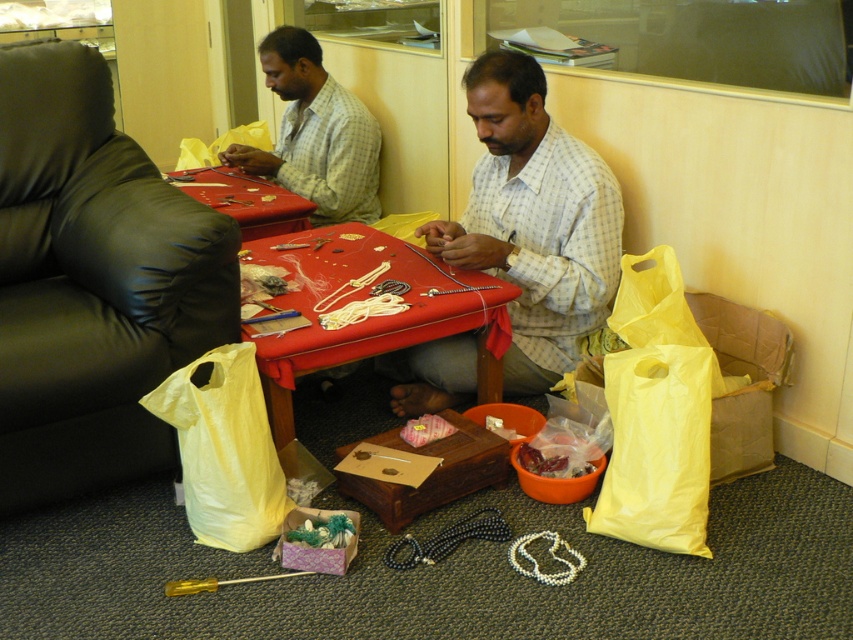
Question: Does white checkered shirt at center appear under translucent plastic bag at lower center?

Choices:
 (A) no
 (B) yes

Answer: (A)

Question: Is yellow plastic bag at lower right in front of red fabric table at center?

Choices:
 (A) yes
 (B) no

Answer: (A)

Question: Does red fabric table at center appear under light brown checkered shirt at center?

Choices:
 (A) no
 (B) yes

Answer: (B)

Question: Which is farther from the yellow plastic bag at lower left?

Choices:
 (A) green leafy vegetables at center
 (B) red leather table at center
 (C) red fabric table at center
 (D) translucent plastic bag at lower center

Answer: (B)

Question: Based on their relative distances, which object is nearer to the white checkered shirt at center?

Choices:
 (A) light brown checkered shirt at center
 (B) green leafy vegetables at center
 (C) translucent plastic bag at lower center
 (D) red fabric table at center

Answer: (D)

Question: Which object is farther from the camera taking this photo?

Choices:
 (A) white checkered shirt at center
 (B) red leather table at center

Answer: (B)